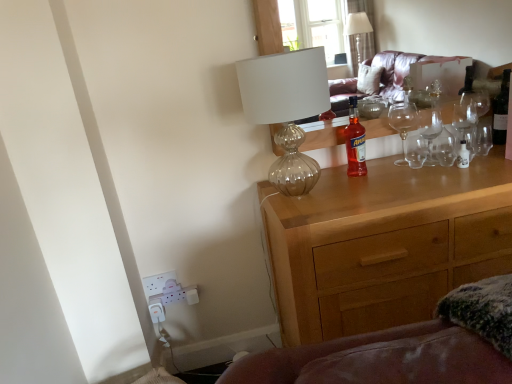
Image resolution: width=512 pixels, height=384 pixels. Identify the location of vacant region below translucent glass lamp at upper center (from a real-world perspective). (301, 198).